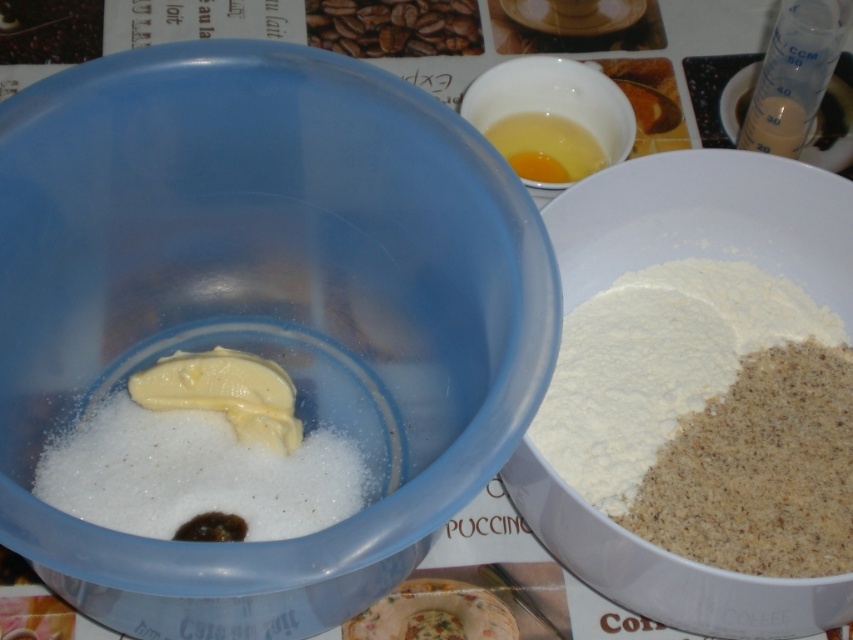
You are a chef preparing a recipe that requires a bowl. You have two options in the image, the blue mixing bowl and the translucent plastic bowl at center. Which bowl is located at the point with coordinates (262, 301)?

The translucent plastic bowl at center is located at point (262, 301).

You are a chef holding a spoon and standing in front of the translucent plastic bowl at center. You want to stir the mixture inside without leaning forward. Can you reach the center of the bowl with your spoon from your current position?

The translucent plastic bowl at center is 15.15 inches away from the viewer. Since the chef is holding a spoon and standing at this distance, they can likely reach the center of the bowl without leaning forward as 15.15 inches is a manageable distance for stirring.